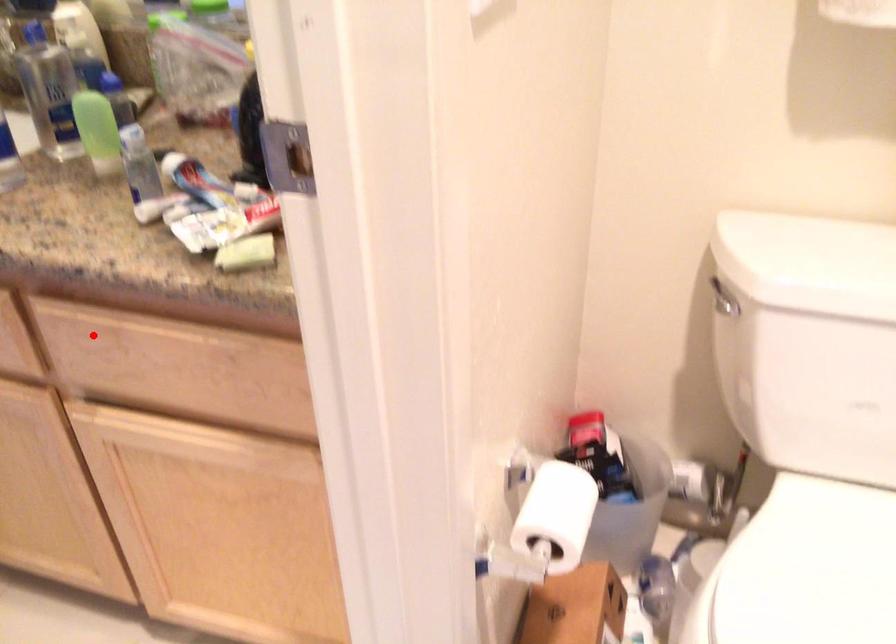
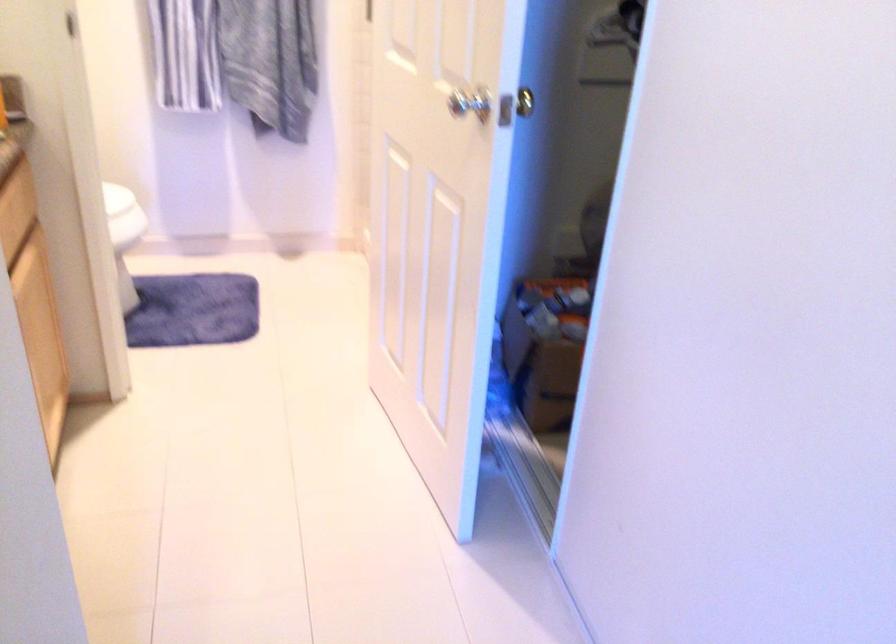
Question: I am providing you with two images of the same scene from different viewpoints. In image1, a red point is highlighted. Considering the same 3D point in image2, which of the following is correct?

Choices:
 (A) It is closer
 (B) It is farther

Answer: (B)